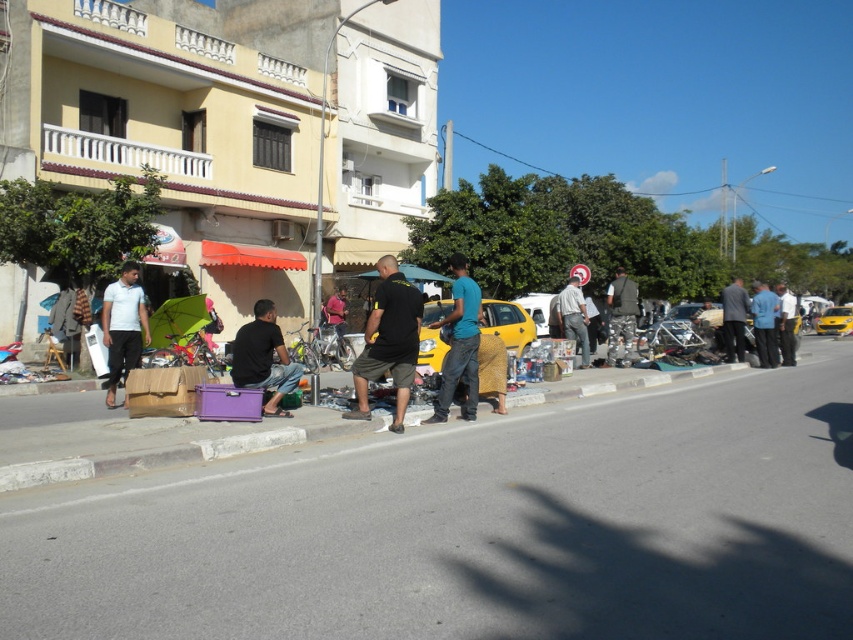
I want to click on black cotton t-shirt at center, so click(x=387, y=340).

Which is behind, point (413, 362) or point (106, 308)?

Point (106, 308)

Image resolution: width=853 pixels, height=640 pixels. What are the coordinates of `black cotton t-shirt at center` in the screenshot? It's located at (387, 340).

The width and height of the screenshot is (853, 640). In order to click on black cotton t-shirt at center in this screenshot , I will do `click(387, 340)`.

Who is more distant from viewer, (538, 400) or (386, 273)?

The point (538, 400) is more distant.

Which is in front, point (78, 465) or point (387, 358)?

Point (78, 465) is more forward.

Image resolution: width=853 pixels, height=640 pixels. What do you see at coordinates (167, 454) in the screenshot? I see `concrete at lower center` at bounding box center [167, 454].

The height and width of the screenshot is (640, 853). I want to click on concrete at lower center, so click(167, 454).

Which is in front, point (73, 460) or point (259, 380)?

Point (73, 460)

Who is lower down, concrete at lower center or black matte shirt at lower left?

concrete at lower center is below.

This screenshot has height=640, width=853. Identify the location of concrete at lower center. (167, 454).

The height and width of the screenshot is (640, 853). Find the location of `concrete at lower center`. concrete at lower center is located at coordinates (167, 454).